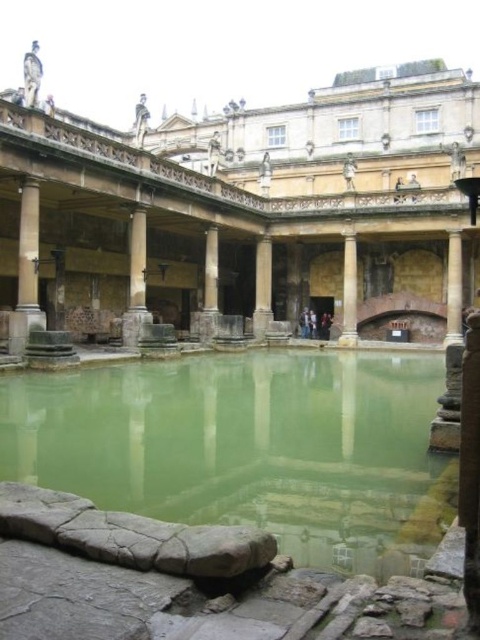
Is stone palace at center to the right of smooth stone pillar at left from the viewer's perspective?

Indeed, stone palace at center is positioned on the right side of smooth stone pillar at left.

Between stone palace at center and smooth stone pillar at left, which one appears on the left side from the viewer's perspective?

Positioned to the left is smooth stone pillar at left.

Find the location of `stone palace at center`. stone palace at center is located at coordinates (252, 209).

From the picture: Which is more to the left, stone palace at center or gray stone pillar at center?

stone palace at center is more to the left.

Can you confirm if stone palace at center is shorter than gray stone pillar at center?

Incorrect, stone palace at center's height does not fall short of gray stone pillar at center's.

The height and width of the screenshot is (640, 480). What do you see at coordinates (252, 209) in the screenshot?
I see `stone palace at center` at bounding box center [252, 209].

Where is `stone palace at center`? stone palace at center is located at coordinates (252, 209).

Does green stone water at center appear over smooth stone pillar at left?

Incorrect, green stone water at center is not positioned above smooth stone pillar at left.

Does green stone water at center have a smaller size compared to smooth stone pillar at left?

No.

Which is behind, point (441, 371) or point (17, 301)?

Positioned behind is point (441, 371).

Find the location of a particular element. The image size is (480, 640). green stone water at center is located at coordinates (249, 448).